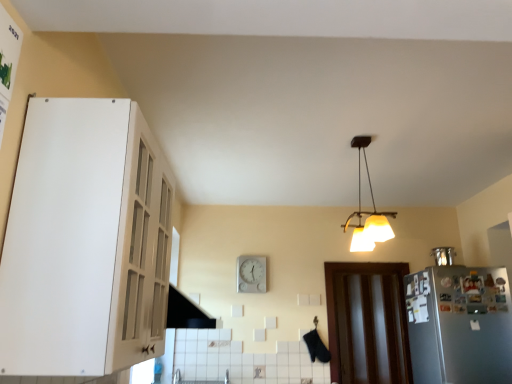
You are a GUI agent. You are given a task and a screenshot of the screen. Output one action in this format:
    pyautogui.click(x=<x>, y=<y>)
    Task: Click on the white glossy cabinet at upper left
    
    Given the screenshot: What is the action you would take?
    pyautogui.click(x=85, y=241)

From a real-world perspective, which is physically above, metallic refrigerator at right or white plastic clock at center?

From a 3D spatial view, metallic refrigerator at right is above.

Which object is positioned more to the left, metallic refrigerator at right or white plastic clock at center?

Positioned to the left is white plastic clock at center.

Does matte yellow lampshade at upper center appear on the right side of brown wooden door at lower right?

No, matte yellow lampshade at upper center is not to the right of brown wooden door at lower right.

Considering the relative sizes of matte yellow lampshade at upper center and brown wooden door at lower right in the image provided, is matte yellow lampshade at upper center wider than brown wooden door at lower right?

Indeed, matte yellow lampshade at upper center has a greater width compared to brown wooden door at lower right.

Considering the points (357, 228) and (384, 341), which point is in front, point (357, 228) or point (384, 341)?

The point (357, 228) is closer.

Can you confirm if matte yellow lampshade at upper center is bigger than white plastic clock at center?

Yes, matte yellow lampshade at upper center is bigger than white plastic clock at center.

From the image's perspective, which is above, matte yellow lampshade at upper center or white plastic clock at center?

matte yellow lampshade at upper center is shown above in the image.

Is white plastic clock at center at the back of matte yellow lampshade at upper center?

That's not correct — matte yellow lampshade at upper center is not looking away from white plastic clock at center.

Considering the positions of objects satin silver refrigerator at right and white plastic clock at center in the image provided, who is in front, satin silver refrigerator at right or white plastic clock at center?

satin silver refrigerator at right.

Can you confirm if satin silver refrigerator at right is thinner than white plastic clock at center?

No.

Which point is more forward, (481,338) or (251,290)?

The point (481,338) is closer.

Considering the sizes of objects white plastic clock at center and satin silver refrigerator at right in the image provided, who is taller, white plastic clock at center or satin silver refrigerator at right?

With more height is satin silver refrigerator at right.

Is white plastic clock at center surrounding satin silver refrigerator at right?

No, white plastic clock at center does not contain satin silver refrigerator at right.

From a real-world perspective, is white plastic clock at center over satin silver refrigerator at right?

Yes, from a real-world perspective, white plastic clock at center is above satin silver refrigerator at right.

Is point (261, 271) closer to camera compared to point (454, 355)?

That is False.

Considering the relative sizes of satin silver refrigerator at right and metallic refrigerator at right in the image provided, is satin silver refrigerator at right taller than metallic refrigerator at right?

Correct, satin silver refrigerator at right is much taller as metallic refrigerator at right.

In terms of width, does satin silver refrigerator at right look wider or thinner when compared to metallic refrigerator at right?

In the image, satin silver refrigerator at right appears to be wider than metallic refrigerator at right.

Could you tell me if satin silver refrigerator at right is facing metallic refrigerator at right?

No, satin silver refrigerator at right is not aimed at metallic refrigerator at right.

From the image's perspective, is satin silver refrigerator at right above or below metallic refrigerator at right?

From the image's perspective, satin silver refrigerator at right appears below metallic refrigerator at right.

Can you confirm if metallic refrigerator at right is smaller than satin silver refrigerator at right?

Indeed, metallic refrigerator at right has a smaller size compared to satin silver refrigerator at right.

Considering the positions of objects metallic refrigerator at right and satin silver refrigerator at right in the image provided, who is behind, metallic refrigerator at right or satin silver refrigerator at right?

metallic refrigerator at right is further from the camera.

Identify the location of appliance that appears behind the satin silver refrigerator at right. (443, 255).

Can satin silver refrigerator at right be found inside metallic refrigerator at right?

No, metallic refrigerator at right does not contain satin silver refrigerator at right.

I want to click on appliance above the white plastic clock at center (from the image's perspective), so click(x=443, y=255).

Where is `door on the right side of matte yellow lampshade at upper center`? The width and height of the screenshot is (512, 384). door on the right side of matte yellow lampshade at upper center is located at coordinates (368, 323).

Estimate the real-world distances between objects in this image. Which object is closer to brown wooden door at lower right, matte yellow lampshade at upper center or satin silver refrigerator at right?

satin silver refrigerator at right is positioned closer to the anchor brown wooden door at lower right.

Looking at the image, which one is located closer to white plastic clock at center, brown wooden door at lower right or metallic refrigerator at right?

brown wooden door at lower right.

Based on their spatial positions, is white plastic clock at center or satin silver refrigerator at right further from matte yellow lampshade at upper center?

The object further to matte yellow lampshade at upper center is white plastic clock at center.

Consider the image. Considering their positions, is satin silver refrigerator at right positioned closer to brown wooden door at lower right than white plastic clock at center?

satin silver refrigerator at right is positioned closer to the anchor brown wooden door at lower right.

Considering their positions, is white glossy cabinet at upper left positioned closer to brown wooden door at lower right than matte yellow lampshade at upper center?

Based on the image, matte yellow lampshade at upper center appears to be nearer to brown wooden door at lower right.

Estimate the real-world distances between objects in this image. Which object is further from white glossy cabinet at upper left, matte yellow lampshade at upper center or brown wooden door at lower right?

brown wooden door at lower right.

When comparing their distances from matte yellow lampshade at upper center, does brown wooden door at lower right or satin silver refrigerator at right seem further?

Among the two, satin silver refrigerator at right is located further to matte yellow lampshade at upper center.

Considering their positions, is white plastic clock at center positioned closer to brown wooden door at lower right than satin silver refrigerator at right?

satin silver refrigerator at right.

Identify the location of door between matte yellow lampshade at upper center and white plastic clock at center from front to back. (368, 323).

Where is `lamp located between white glossy cabinet at upper left and white plastic clock at center in the depth direction`? The width and height of the screenshot is (512, 384). lamp located between white glossy cabinet at upper left and white plastic clock at center in the depth direction is located at coordinates (368, 212).

Identify the location of appliance between satin silver refrigerator at right and brown wooden door at lower right along the z-axis. This screenshot has height=384, width=512. (443, 255).

Find the location of `lamp located between white glossy cabinet at upper left and metallic refrigerator at right in the depth direction`. lamp located between white glossy cabinet at upper left and metallic refrigerator at right in the depth direction is located at coordinates (368, 212).